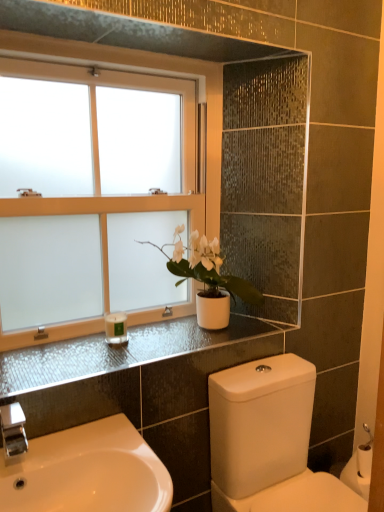
Question: From the image's perspective, is white glossy sink at lower left on top of white matte candle at lower left?

Choices:
 (A) no
 (B) yes

Answer: (A)

Question: Would you consider white glossy sink at lower left to be distant from white matte candle at lower left?

Choices:
 (A) yes
 (B) no

Answer: (B)

Question: Is white glossy sink at lower left smaller than white matte candle at lower left?

Choices:
 (A) no
 (B) yes

Answer: (A)

Question: From a real-world perspective, is white glossy sink at lower left physically below white matte candle at lower left?

Choices:
 (A) yes
 (B) no

Answer: (A)

Question: Is white glossy sink at lower left bigger than white matte candle at lower left?

Choices:
 (A) yes
 (B) no

Answer: (A)

Question: Is white glossy sink at lower left positioned before white matte candle at lower left?

Choices:
 (A) yes
 (B) no

Answer: (A)

Question: Is white frosted glass window at upper left bigger than white glossy sink at lower left?

Choices:
 (A) yes
 (B) no

Answer: (A)

Question: Is white glossy sink at lower left located within white frosted glass window at upper left?

Choices:
 (A) no
 (B) yes

Answer: (A)

Question: Is white frosted glass window at upper left not near white glossy sink at lower left?

Choices:
 (A) no
 (B) yes

Answer: (A)

Question: Considering the relative sizes of white frosted glass window at upper left and white glossy sink at lower left in the image provided, is white frosted glass window at upper left smaller than white glossy sink at lower left?

Choices:
 (A) no
 (B) yes

Answer: (A)

Question: Are white frosted glass window at upper left and white glossy sink at lower left making contact?

Choices:
 (A) no
 (B) yes

Answer: (A)

Question: Can you confirm if white frosted glass window at upper left is positioned to the left of white glossy sink at lower left?

Choices:
 (A) no
 (B) yes

Answer: (B)

Question: Can you confirm if white glossy sink at lower left is smaller than white matte pot at center?

Choices:
 (A) yes
 (B) no

Answer: (B)